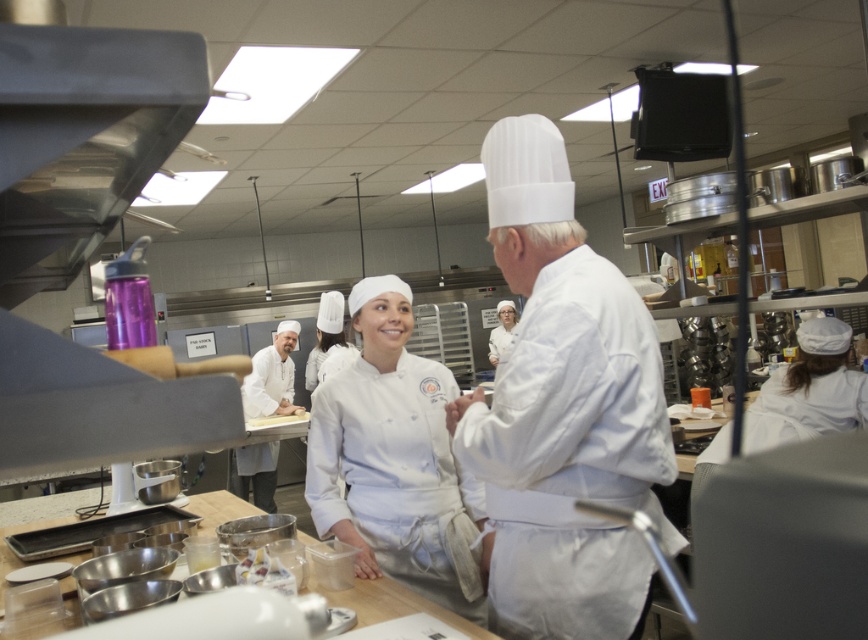
Based on the photo, can you confirm if white matte chef hat at center is shorter than white matte chef's coat at center?

Incorrect, white matte chef hat at center's height does not fall short of white matte chef's coat at center's.

At what (x,y) coordinates should I click in order to perform the action: click on white matte chef hat at center. Please return your answer as a coordinate pair (x, y). The image size is (868, 640). Looking at the image, I should click on (563, 410).

Where is `white matte chef hat at center`? white matte chef hat at center is located at coordinates (563, 410).

Does point (389, 284) come closer to viewer compared to point (261, 465)?

Yes, point (389, 284) is closer to viewer.

Who is more distant from viewer, (413, 444) or (253, 502)?

The point (253, 502) is behind.

Find the location of a particular element. white matte chef's coat at center is located at coordinates (395, 460).

How distant is white matte chef hat at center from white chef coat at center?

A distance of 3.68 meters exists between white matte chef hat at center and white chef coat at center.

Between white matte chef hat at center and white chef coat at center, which one has less height?

white matte chef hat at center

Is point (518, 620) closer to camera compared to point (260, 500)?

Yes, point (518, 620) is in front of point (260, 500).

The width and height of the screenshot is (868, 640). Identify the location of white matte chef hat at center. (563, 410).